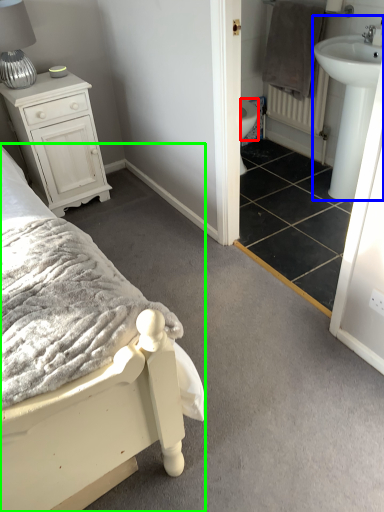
Question: Considering the real-world distances, which object is closest to bidet (highlighted by a red box)? sink (highlighted by a blue box) or bed (highlighted by a green box).

Choices:
 (A) sink
 (B) bed

Answer: (A)